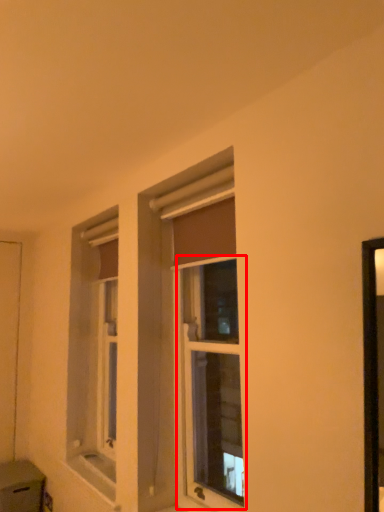
Question: From the image's perspective, where is window (annotated by the red box) located in relation to screen door in the image?

Choices:
 (A) above
 (B) below

Answer: (A)